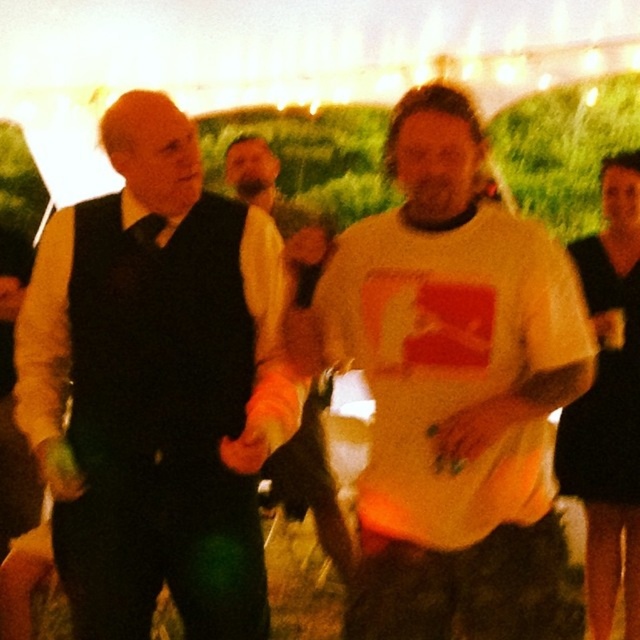
Which is more to the right, black satin dress at center or orange fabric shirt at center?

Positioned to the right is black satin dress at center.

Is black satin dress at center to the left of orange fabric shirt at center from the viewer's perspective?

Incorrect, black satin dress at center is not on the left side of orange fabric shirt at center.

You are a GUI agent. You are given a task and a screenshot of the screen. Output one action in this format:
    pyautogui.click(x=<x>, y=<y>)
    Task: Click on the black satin dress at center
    Image resolution: width=640 pixels, height=640 pixels.
    Given the screenshot: What is the action you would take?
    pyautogui.click(x=604, y=392)

Identify the location of black satin dress at center. (604, 392).

Between point (566, 276) and point (566, 417), which one is positioned in front?

Point (566, 276)

From the picture: Is white matte t-shirt at center to the right of black satin dress at center from the viewer's perspective?

Incorrect, white matte t-shirt at center is not on the right side of black satin dress at center.

Who is more forward, [451,467] or [634,396]?

Point [451,467]

Locate an element on the screen. white matte t-shirt at center is located at coordinates (452, 388).

Does matte black vest at left appear on the right side of orange fabric shirt at center?

Incorrect, matte black vest at left is not on the right side of orange fabric shirt at center.

Does matte black vest at left have a larger size compared to orange fabric shirt at center?

Yes.

Is point (152, 198) closer to viewer compared to point (301, 438)?

Yes, point (152, 198) is closer to viewer.

This screenshot has width=640, height=640. What are the coordinates of `matte black vest at left` in the screenshot? It's located at (150, 385).